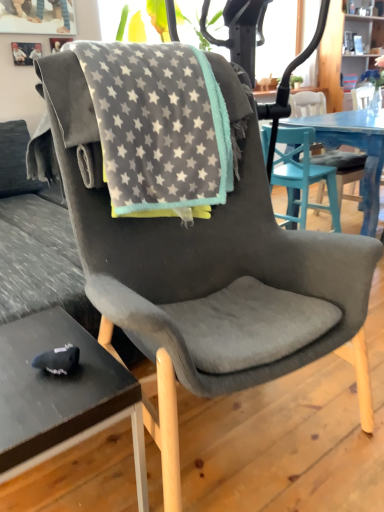
Question: In the image, is gray fleece blanket at center on the left side or the right side of black matte desk at lower left?

Choices:
 (A) left
 (B) right

Answer: (B)

Question: Considering the positions of gray fleece blanket at center and black matte desk at lower left in the image, is gray fleece blanket at center taller or shorter than black matte desk at lower left?

Choices:
 (A) tall
 (B) short

Answer: (A)

Question: Estimate the real-world distances between objects in this image. Which object is farther from the gray fleece blanket at center?

Choices:
 (A) black matte desk at lower left
 (B) suede gray chair at center

Answer: (B)

Question: Based on their relative distances, which object is farther from the gray fleece blanket at center?

Choices:
 (A) black matte desk at lower left
 (B) suede gray chair at center

Answer: (B)